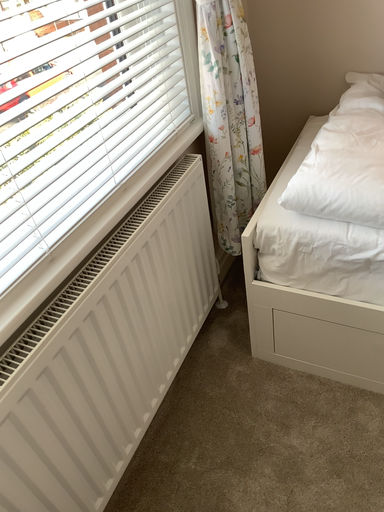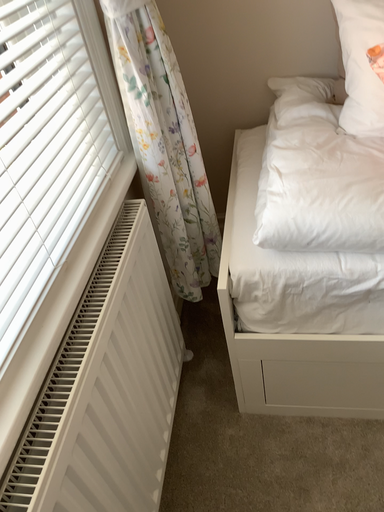
Question: How did the camera likely rotate when shooting the video?

Choices:
 (A) rotated left
 (B) rotated right

Answer: (B)